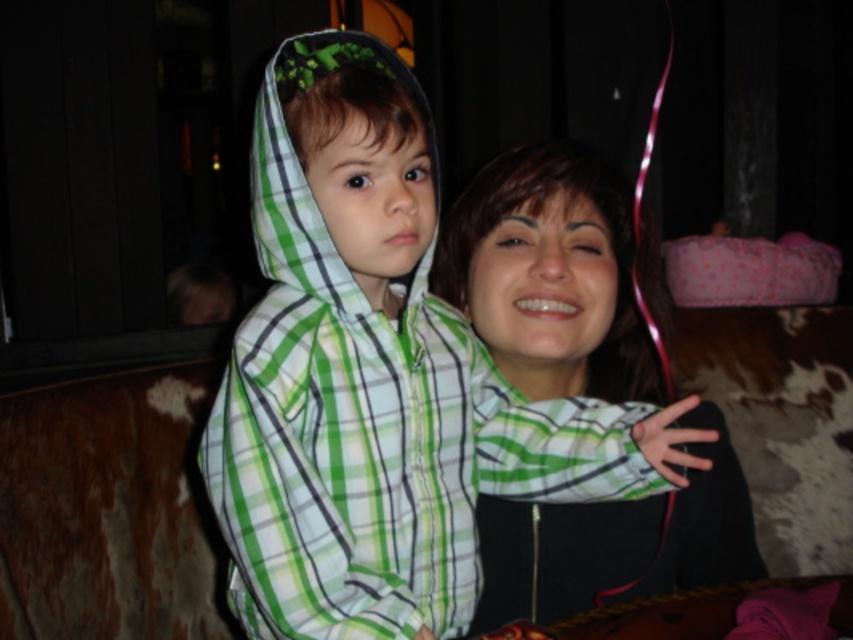
Question: Which point is closer to the camera taking this photo?

Choices:
 (A) (428, 621)
 (B) (553, 259)

Answer: (A)

Question: Which of the following is the closest to the observer?

Choices:
 (A) (381, 74)
 (B) (535, 563)

Answer: (A)

Question: Is green plaid hoodie at center closer to the viewer compared to matte green plaid shirt at center?

Choices:
 (A) no
 (B) yes

Answer: (B)

Question: Can you confirm if green plaid hoodie at center is positioned to the left of matte green plaid shirt at center?

Choices:
 (A) no
 (B) yes

Answer: (B)

Question: Can you confirm if green plaid hoodie at center is positioned below matte green plaid shirt at center?

Choices:
 (A) yes
 (B) no

Answer: (B)